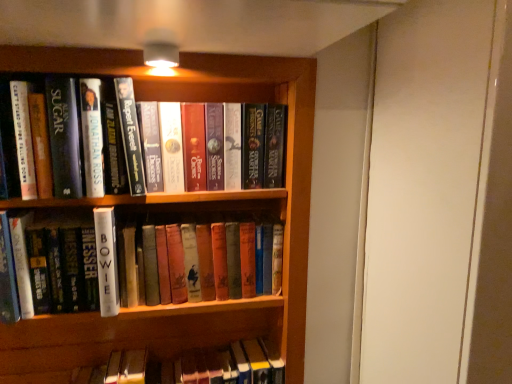
At what (x,y) coordinates should I click in order to perform the action: click on white matte book at center, the 1th book when ordered from bottom to top. Please return your answer as a coordinate pair (x, y). This screenshot has height=384, width=512. Looking at the image, I should click on (135, 264).

Locate an element on the screen. white matte book at center, which ranks as the 3th book in top-to-bottom order is located at coordinates (135, 264).

Considering the sizes of hardcover book at upper left, which is the 2th book from bottom to top, and wooden bookcase at center in the image, is hardcover book at upper left, which is the 2th book from bottom to top, taller or shorter than wooden bookcase at center?

hardcover book at upper left, which is the 2th book from bottom to top, is shorter than wooden bookcase at center.

Can we say hardcover book at upper left, which is the 2th book from bottom to top, lies outside wooden bookcase at center?

Actually, hardcover book at upper left, which is the 2th book from bottom to top, is at least partially inside wooden bookcase at center.

Does point (234, 187) appear closer or farther from the camera than point (59, 62)?

Point (234, 187) appears to be farther away from the viewer than point (59, 62).

From a real-world perspective, count 3rd books upward from the wooden bookcase at center and point to it. Please provide its 2D coordinates.

[(141, 141)]

Which object is more forward, hardcover books at center, the 1th book from the top, or white matte book at center, the 1th book when ordered from bottom to top?

white matte book at center, the 1th book when ordered from bottom to top, is in front.

Is hardcover books at center, positioned as the 3th book in bottom-to-top order, directly adjacent to white matte book at center, which ranks as the 3th book in top-to-bottom order?

hardcover books at center, positioned as the 3th book in bottom-to-top order, is not next to white matte book at center, which ranks as the 3th book in top-to-bottom order, and they're not touching.

Does hardcover books at center, the 1th book from the top, turn towards white matte book at center, which ranks as the 3th book in top-to-bottom order?

No, hardcover books at center, the 1th book from the top, is not turned towards white matte book at center, which ranks as the 3th book in top-to-bottom order.

Starting from the hardcover books at center, the 1th book from the top, which book is the 1st one in front? Please provide its 2D coordinates.

[(135, 264)]

From their relative heights in the image, would you say white matte book at center, which ranks as the 3th book in top-to-bottom order, is taller or shorter than hardcover books at center, the 1th book from the top?

white matte book at center, which ranks as the 3th book in top-to-bottom order, is taller than hardcover books at center, the 1th book from the top.

Looking at this image, is the position of white matte book at center, the 1th book when ordered from bottom to top, less distant than that of hardcover books at center, positioned as the 3th book in bottom-to-top order?

Yes.

In the scene shown: Is white matte book at center, which ranks as the 3th book in top-to-bottom order, oriented away from hardcover books at center, the 1th book from the top?

No.

Looking at this image, is wooden bookcase at center facing towards white matte book at center, the 1th book when ordered from bottom to top?

Yes, wooden bookcase at center is oriented towards white matte book at center, the 1th book when ordered from bottom to top.

Is wooden bookcase at center in front of white matte book at center, which ranks as the 3th book in top-to-bottom order?

Yes, it is in front of white matte book at center, which ranks as the 3th book in top-to-bottom order.

This screenshot has height=384, width=512. I want to click on bookcase below the white matte book at center, the 1th book when ordered from bottom to top (from the image's perspective), so click(x=224, y=101).

From the image's perspective, which one is positioned lower, wooden bookcase at center or white matte book at center, which ranks as the 3th book in top-to-bottom order?

wooden bookcase at center.

How different are the orientations of white matte book at center, which ranks as the 3th book in top-to-bottom order, and hardcover book at upper left, which is the 2th book from bottom to top, in degrees?

Result: There is a 0.00518-degree angle between the facing directions of white matte book at center, which ranks as the 3th book in top-to-bottom order, and hardcover book at upper left, which is the 2th book from bottom to top.

Can you confirm if white matte book at center, which ranks as the 3th book in top-to-bottom order, is shorter than hardcover book at upper left, which is the 2th book from bottom to top?

Yes, white matte book at center, which ranks as the 3th book in top-to-bottom order, is shorter than hardcover book at upper left, which is the 2th book from bottom to top.

Is white matte book at center, the 1th book when ordered from bottom to top, positioned far away from hardcover book at upper left, the second book when ordered from top to bottom?

No.

From a real-world perspective, is white matte book at center, which ranks as the 3th book in top-to-bottom order, positioned under hardcover book at upper left, the second book when ordered from top to bottom, based on gravity?

Yes, from a real-world perspective, white matte book at center, which ranks as the 3th book in top-to-bottom order, is under hardcover book at upper left, the second book when ordered from top to bottom.

From the image's perspective, between white matte book at center, the 1th book when ordered from bottom to top, and wooden bookcase at center, who is located below?

From the image's view, wooden bookcase at center is below.

Looking at this image, what's the angular difference between white matte book at center, the 1th book when ordered from bottom to top, and wooden bookcase at center's facing directions?

white matte book at center, the 1th book when ordered from bottom to top, and wooden bookcase at center are facing 0.00291 degrees away from each other.

How far apart are white matte book at center, which ranks as the 3th book in top-to-bottom order, and wooden bookcase at center?

white matte book at center, which ranks as the 3th book in top-to-bottom order, is 10.88 inches from wooden bookcase at center.

Locate an element on the screen. The image size is (512, 384). bookcase in front of the white matte book at center, the 1th book when ordered from bottom to top is located at coordinates (224, 101).

Is hardcover books at center, the 1th book from the top, positioned with its back to wooden bookcase at center?

Yes, hardcover books at center, the 1th book from the top,'s orientation is away from wooden bookcase at center.

How many degrees apart are the facing directions of hardcover books at center, positioned as the 3th book in bottom-to-top order, and wooden bookcase at center?

The angular difference between hardcover books at center, positioned as the 3th book in bottom-to-top order, and wooden bookcase at center is 0.00253 degrees.

Is hardcover books at center, the 1th book from the top, positioned beyond the bounds of wooden bookcase at center?

No, hardcover books at center, the 1th book from the top, is inside wooden bookcase at center's boundary.

Locate an element on the screen. Image resolution: width=512 pixels, height=384 pixels. bookcase beneath the hardcover book at upper left, which is the 2th book from bottom to top (from a real-world perspective) is located at coordinates 224,101.

At what (x,y) coordinates should I click in order to perform the action: click on book located on the right of white matte book at center, which ranks as the 3th book in top-to-bottom order. Please return your answer as a coordinate pair (x, y). Looking at the image, I should click on (232, 147).

From the image, which object appears to be farther from white matte book at center, the 1th book when ordered from bottom to top, hardcover book at upper left, which is the 2th book from bottom to top, or wooden bookcase at center?

wooden bookcase at center.

Which object lies nearer to the anchor point white matte book at center, the 1th book when ordered from bottom to top, wooden bookcase at center or hardcover books at center, the 1th book from the top?

The object closer to white matte book at center, the 1th book when ordered from bottom to top, is hardcover books at center, the 1th book from the top.

Considering their positions, is white matte book at center, the 1th book when ordered from bottom to top, positioned further to hardcover books at center, the 1th book from the top, than hardcover book at upper left, which is the 2th book from bottom to top?

white matte book at center, the 1th book when ordered from bottom to top.

When comparing their distances from white matte book at center, which ranks as the 3th book in top-to-bottom order, does hardcover books at center, positioned as the 3th book in bottom-to-top order, or hardcover book at upper left, which is the 2th book from bottom to top, seem closer?

Based on the image, hardcover book at upper left, which is the 2th book from bottom to top, appears to be nearer to white matte book at center, which ranks as the 3th book in top-to-bottom order.

Looking at the image, which one is located further to wooden bookcase at center, hardcover book at upper left, which is the 2th book from bottom to top, or white matte book at center, the 1th book when ordered from bottom to top?

white matte book at center, the 1th book when ordered from bottom to top, is positioned further to the anchor wooden bookcase at center.

Based on their spatial positions, is wooden bookcase at center or white matte book at center, the 1th book when ordered from bottom to top, further from hardcover book at upper left, which is the 2th book from bottom to top?

white matte book at center, the 1th book when ordered from bottom to top, is positioned further to the anchor hardcover book at upper left, which is the 2th book from bottom to top.

Looking at the image, which one is located further to hardcover books at center, the 1th book from the top, white matte book at center, the 1th book when ordered from bottom to top, or wooden bookcase at center?

white matte book at center, the 1th book when ordered from bottom to top.

Estimate the real-world distances between objects in this image. Which object is closer to white matte book at center, which ranks as the 3th book in top-to-bottom order, wooden bookcase at center or hardcover book at upper left, the second book when ordered from top to bottom?

hardcover book at upper left, the second book when ordered from top to bottom, is positioned closer to the anchor white matte book at center, which ranks as the 3th book in top-to-bottom order.

I want to click on book between hardcover book at upper left, which is the 2th book from bottom to top, and wooden bookcase at center in the up-down direction, so click(x=135, y=264).

At what (x,y) coordinates should I click in order to perform the action: click on book located between hardcover book at upper left, the second book when ordered from top to bottom, and hardcover books at center, positioned as the 3th book in bottom-to-top order, in the left-right direction. Please return your answer as a coordinate pair (x, y). Looking at the image, I should click on pyautogui.click(x=135, y=264).

Find the location of a particular element. This screenshot has height=384, width=512. bookcase located between hardcover book at upper left, which is the 2th book from bottom to top, and hardcover books at center, positioned as the 3th book in bottom-to-top order, in the left-right direction is located at coordinates (224, 101).